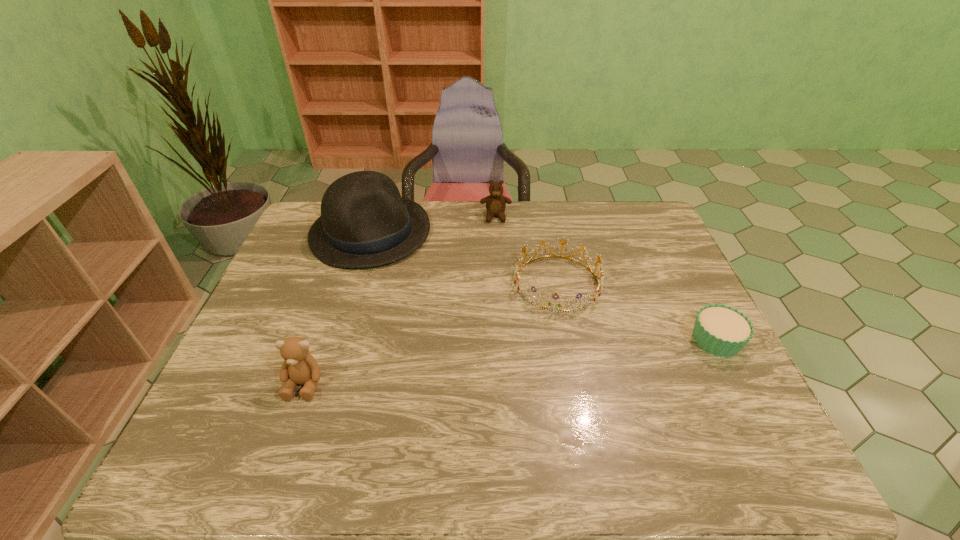
This screenshot has width=960, height=540. What are the coordinates of `the left teddy bear` in the screenshot? It's located at (299, 367).

Identify the location of the nearest object. The width and height of the screenshot is (960, 540). click(x=299, y=367).

The height and width of the screenshot is (540, 960). What are the coordinates of `cupcake` in the screenshot? It's located at (720, 330).

Find the location of `the shortest object`. the shortest object is located at coordinates (720, 330).

Image resolution: width=960 pixels, height=540 pixels. Find the location of `the right teddy bear`. the right teddy bear is located at coordinates (495, 203).

Image resolution: width=960 pixels, height=540 pixels. Identify the location of bowler hat. point(364,222).

Locate an element on the screen. This screenshot has height=540, width=960. tiara is located at coordinates (561, 309).

I want to click on free space located on the front-facing side of the nearest object, so click(x=291, y=423).

The width and height of the screenshot is (960, 540). Find the location of `vacant space located on the left of the shortest object`. vacant space located on the left of the shortest object is located at coordinates (541, 340).

The image size is (960, 540). What are the coordinates of `vacant space located at the face of the right teddy bear` in the screenshot? It's located at (497, 293).